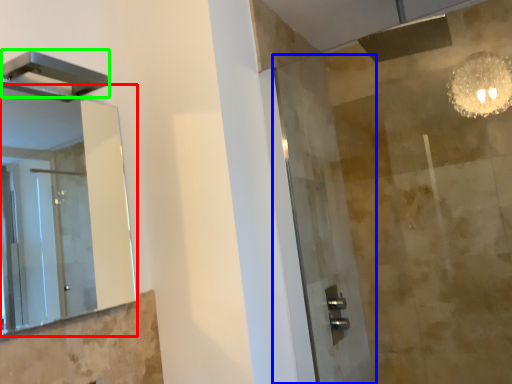
Question: Which object is positioned closest to mirror (highlighted by a red box)? Select from screen door (highlighted by a blue box) and shower (highlighted by a green box).

Choices:
 (A) screen door
 (B) shower

Answer: (A)